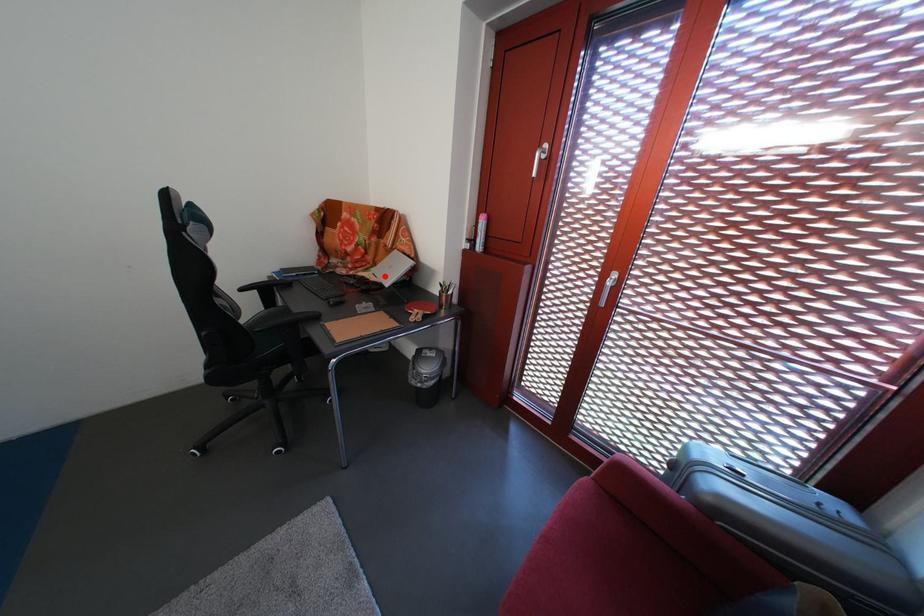
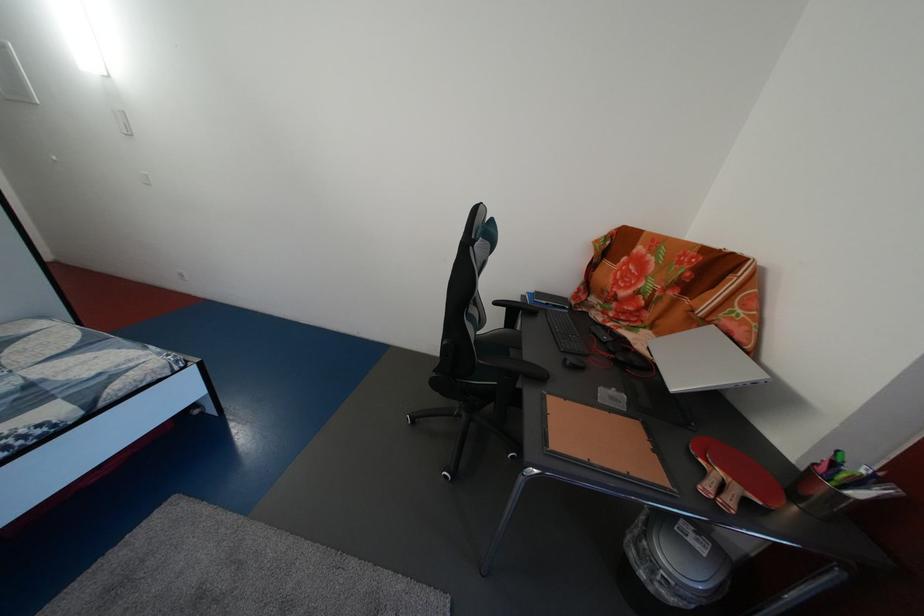
Find the pixel in the second image that matches the highlighted location in the first image.

(657, 339)